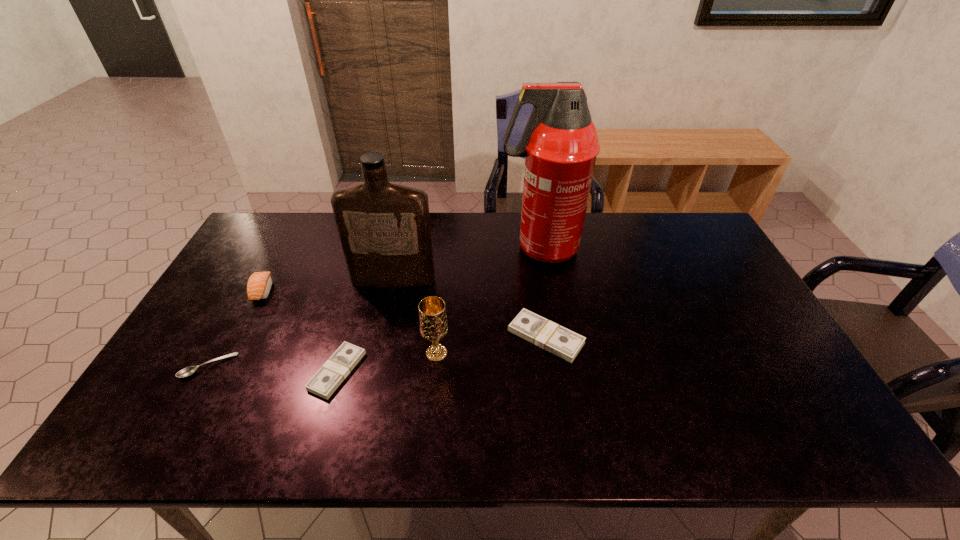
What are the coordinates of `vacant space at the far right corner of the desktop` in the screenshot? It's located at (681, 225).

In the image, there is a desktop. Where is `vacant space at the near right corner`? The image size is (960, 540). vacant space at the near right corner is located at coordinates [775, 401].

This screenshot has height=540, width=960. Identify the location of vacant region between the fire extinguisher and the liquor. (467, 265).

Identify the location of free point between the chalice and the shortest object. (323, 360).

Image resolution: width=960 pixels, height=540 pixels. Identify the location of free point between the soupspoon and the fourth shortest object. (236, 328).

Where is `free space between the tallest object and the chalice`? This screenshot has height=540, width=960. free space between the tallest object and the chalice is located at coordinates (489, 301).

The image size is (960, 540). Identify the location of free space between the fourth tallest object and the left dollar. (300, 331).

The height and width of the screenshot is (540, 960). I want to click on vacant area that lies between the shortest object and the left dollar, so click(273, 368).

Locate an element on the screen. This screenshot has width=960, height=540. free space that is in between the taller dollar and the chalice is located at coordinates (492, 345).

Find the location of a particular element. The image size is (960, 540). object that is the nearest to the shorter dollar is located at coordinates (433, 323).